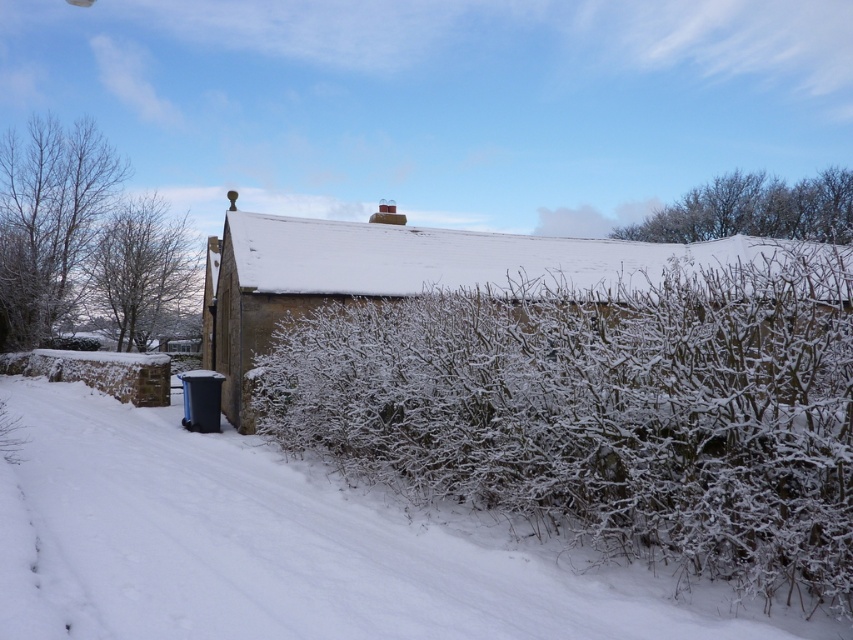
You are standing in front of the rustic stone building and want to walk towards the point marked as point (604, 410). Based on the scene description, what will you encounter first as you move forward?

The point (604, 410) corresponds to the white frosted hedge at center, so you will encounter the white frosted hedge at center first as you move forward.

You are standing in front of the rustic stone building and notice two hedges labeled as white frosted hedge at center and white frosty hedge at center. Which one is closer to you?

The white frosted hedge at center is closer to you since it is in front of the white frosty hedge at center.

You are standing in front of the rustic stone building and notice two hedges. According to the image, which hedge, the white frosted hedge at center or the white frosty hedge at center, is positioned to the right?

The white frosted hedge at center is positioned to the right of the white frosty hedge at center.